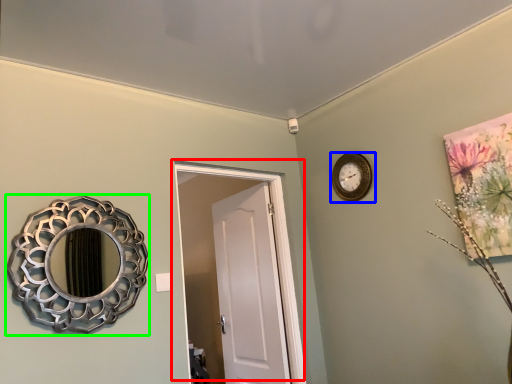
Question: Based on their relative distances, which object is farther from door (highlighted by a red box)? Choose from wall clock (highlighted by a blue box) and mirror (highlighted by a green box).

Choices:
 (A) wall clock
 (B) mirror

Answer: (B)